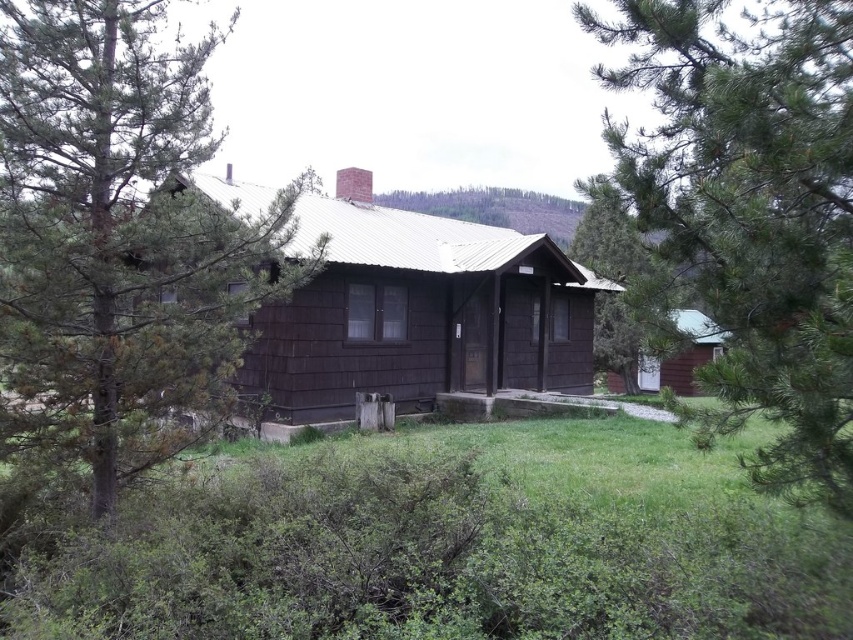
You are standing in front of the rustic wooden cabin and notice two trees. The green pine tree at upper left and the green textured tree at center. Which tree is closer to the cabin?

The green pine tree at upper left is positioned under the green textured tree at center, so the green pine tree at upper left is closer to the cabin.

You are a gardener who wants to plant a new tree between the green pine tree at left and the green pine tree at upper left. The new tree requires a space of 3 meters between it and any existing trees. Is there enough space between them to plant the new tree?

The distance between the green pine tree at left and the green pine tree at upper left is 3.36 meters. Since the new tree requires 3 meters of space between it and existing trees, there is enough space to plant the new tree between them.